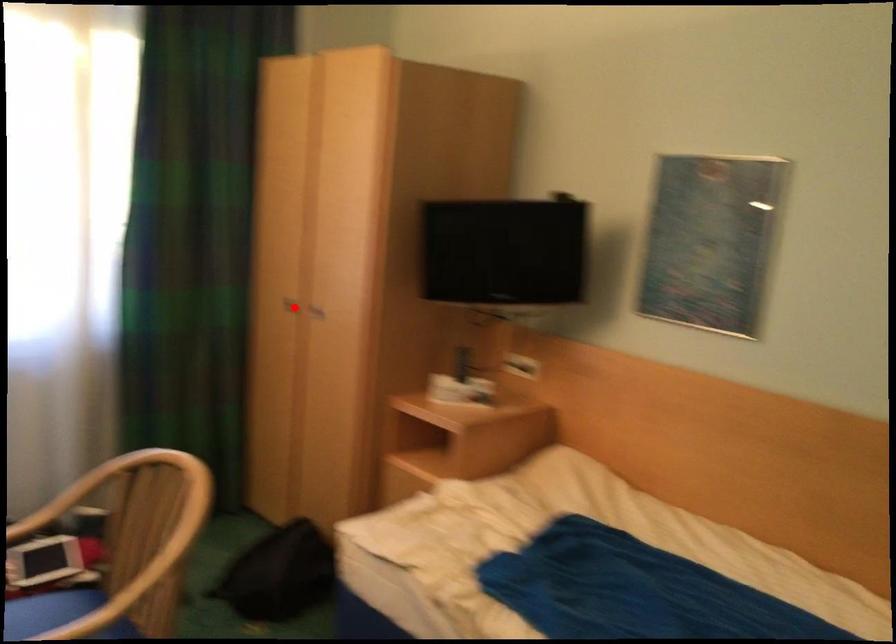
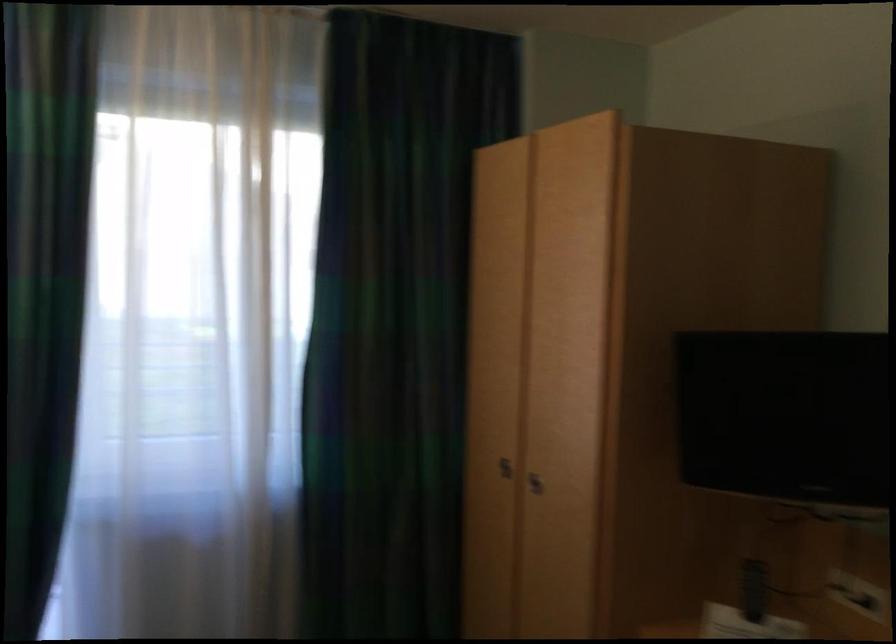
Question: I am providing you with two images of the same scene from different viewpoints. In image1, a red point is highlighted. Considering the same 3D point in image2, which of the following is correct?

Choices:
 (A) It is closer
 (B) It is farther

Answer: (A)